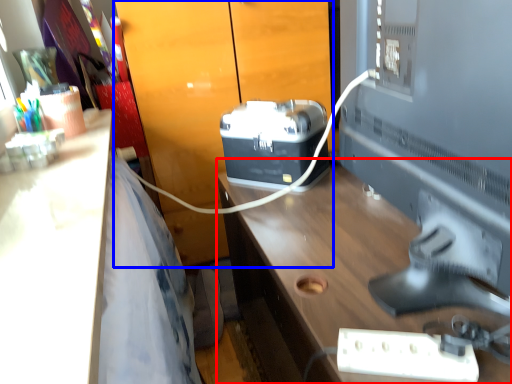
Question: Which of the following is the closest to the observer, desk (highlighted by a red box) or dresser (highlighted by a blue box)?

Choices:
 (A) desk
 (B) dresser

Answer: (A)